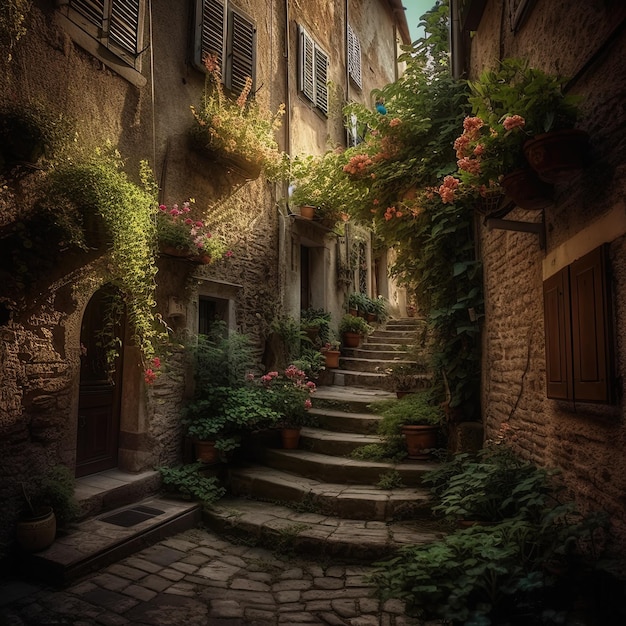
This screenshot has height=626, width=626. In order to click on shutters in this screenshot , I will do `click(315, 76)`, `click(228, 54)`, `click(124, 29)`, `click(356, 59)`.